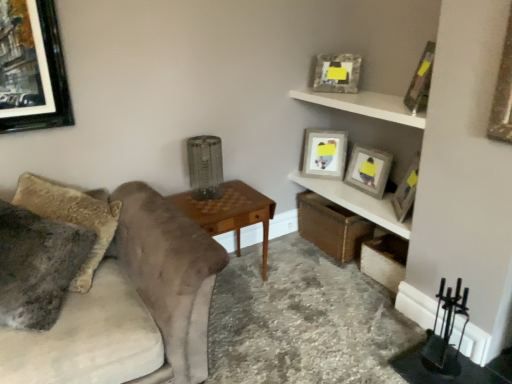
Where is `empty space that is ontop of wooden shelf at upper right, the 2th shelf when ordered from top to bottom`? empty space that is ontop of wooden shelf at upper right, the 2th shelf when ordered from top to bottom is located at coordinates (365, 202).